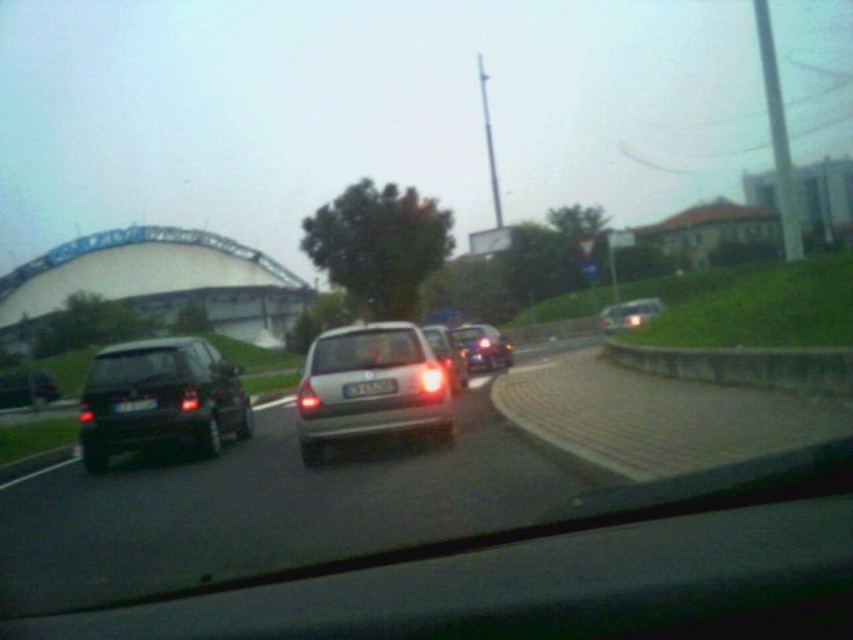
You are driving and see the black matte car at left and the white plastic license plate at center. Which object is closer to you?

The black matte car at left is closer to you because the white plastic license plate at center is behind it, meaning the car is in front of the license plate.

You are driving a car and see the matte black car at left and the satin silver hatchback at center ahead on the road. Which vehicle takes up more space in your view?

The matte black car at left is larger in size than the satin silver hatchback at center, so it takes up more space in your view.

You are a driver looking at the road ahead. You notice a black matte car at left and a white plastic license plate at center. Which object is taller?

The black matte car at left is taller than the white plastic license plate at center.